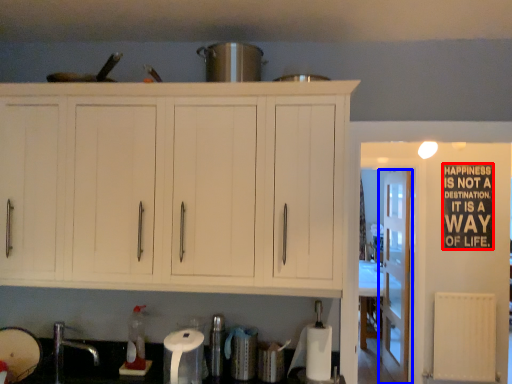
Question: Which of the following is the closest to the observer, bulletin board (highlighted by a red box) or door (highlighted by a blue box)?

Choices:
 (A) bulletin board
 (B) door

Answer: (A)